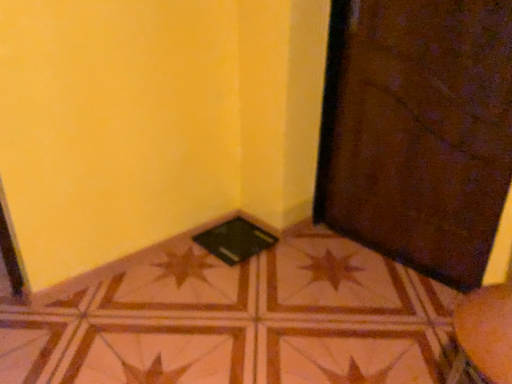
Question: From a real-world perspective, is brown glossy tile at center physically located above or below black matte pad at lower center?

Choices:
 (A) above
 (B) below

Answer: (B)

Question: In the image, is brown glossy tile at center on the left side or the right side of black matte pad at lower center?

Choices:
 (A) right
 (B) left

Answer: (A)

Question: Considering the real-world distances, which object is farthest from the brown glossy tile at center?

Choices:
 (A) black matte pad at lower center
 (B) brown textured door at lower right

Answer: (B)

Question: Which object is the farthest from the brown glossy tile at center?

Choices:
 (A) brown textured door at lower right
 (B) black matte pad at lower center

Answer: (A)